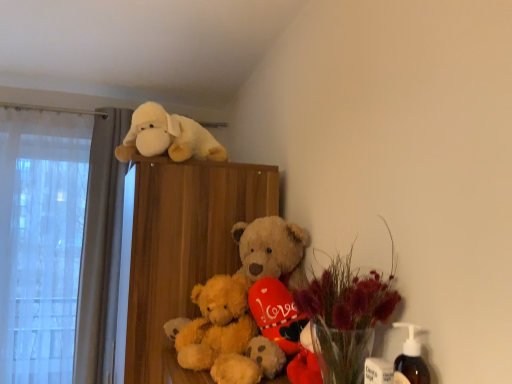
Locate an element on the screen. The height and width of the screenshot is (384, 512). fluffy golden teddy bear at center is located at coordinates (225, 335).

What do you see at coordinates (168, 137) in the screenshot? The height and width of the screenshot is (384, 512). I see `fluffy white plush dog at upper center` at bounding box center [168, 137].

Measure the distance between wooden bookshelf at upper center and camera.

wooden bookshelf at upper center is 1.10 meters away from camera.

Identify the location of translucent glass vase with dried flowers at lower right, which is the first floral arrangement from front to back. (345, 316).

Who is bigger, translucent glass vase with dried flowers at lower right, the 2th floral arrangement in the back-to-front sequence, or fluffy white plush dog at upper center?

fluffy white plush dog at upper center is bigger.

From a real-world perspective, is translucent glass vase with dried flowers at lower right, which is the first floral arrangement from front to back, above or below fluffy white plush dog at upper center?

From a real-world perspective, translucent glass vase with dried flowers at lower right, which is the first floral arrangement from front to back, is physically below fluffy white plush dog at upper center.

From the image's perspective, would you say translucent glass vase with dried flowers at lower right, the 2th floral arrangement in the back-to-front sequence, is positioned over fluffy white plush dog at upper center?

No, from the image's perspective, translucent glass vase with dried flowers at lower right, the 2th floral arrangement in the back-to-front sequence, is not on top of fluffy white plush dog at upper center.

In the scene shown: Considering the sizes of translucent glass vase with dried flowers at lower right, which is the first floral arrangement from front to back, and fluffy white plush dog at upper center in the image, is translucent glass vase with dried flowers at lower right, which is the first floral arrangement from front to back, taller or shorter than fluffy white plush dog at upper center?

translucent glass vase with dried flowers at lower right, which is the first floral arrangement from front to back, is taller than fluffy white plush dog at upper center.

Considering the sizes of objects translucent glass vase with dried flowers at lower right, the 2th floral arrangement in the back-to-front sequence, and translucent glass vase at center, the 2th floral arrangement in the front-to-back sequence, in the image provided, who is shorter, translucent glass vase with dried flowers at lower right, the 2th floral arrangement in the back-to-front sequence, or translucent glass vase at center, the 2th floral arrangement in the front-to-back sequence,?

Standing shorter between the two is translucent glass vase with dried flowers at lower right, the 2th floral arrangement in the back-to-front sequence.

Image resolution: width=512 pixels, height=384 pixels. I want to click on floral arrangement that appears above the translucent glass vase with dried flowers at lower right, which is the first floral arrangement from front to back (from a real-world perspective), so click(x=239, y=290).

Considering the sizes of objects translucent glass vase with dried flowers at lower right, the 2th floral arrangement in the back-to-front sequence, and translucent glass vase at center, the 2th floral arrangement in the front-to-back sequence, in the image provided, who is bigger, translucent glass vase with dried flowers at lower right, the 2th floral arrangement in the back-to-front sequence, or translucent glass vase at center, the 2th floral arrangement in the front-to-back sequence,?

Bigger between the two is translucent glass vase at center, the 2th floral arrangement in the front-to-back sequence.

Is point (378, 301) more distant than point (234, 288)?

No, (378, 301) is closer to viewer.

From a real-world perspective, is fluffy golden teddy bear at center positioned over wooden bookshelf at upper center based on gravity?

Indeed, from a real-world perspective, fluffy golden teddy bear at center stands above wooden bookshelf at upper center.

From the image's perspective, is fluffy golden teddy bear at center below wooden bookshelf at upper center?

No, from the image's perspective, fluffy golden teddy bear at center is not beneath wooden bookshelf at upper center.

Is point (210, 359) behind point (245, 179)?

That is False.

Can you confirm if fluffy golden teddy bear at center is smaller than wooden bookshelf at upper center?

Correct, fluffy golden teddy bear at center occupies less space than wooden bookshelf at upper center.

Does translucent glass vase at center, the 2th floral arrangement in the front-to-back sequence, have a lesser height compared to wooden bookshelf at upper center?

Correct, translucent glass vase at center, the 2th floral arrangement in the front-to-back sequence, is not as tall as wooden bookshelf at upper center.

From the image's perspective, is translucent glass vase at center, the 2th floral arrangement in the front-to-back sequence, located above wooden bookshelf at upper center?

Indeed, from the image's perspective, translucent glass vase at center, the 2th floral arrangement in the front-to-back sequence, is shown above wooden bookshelf at upper center.

Is translucent glass vase at center, which appears as the first floral arrangement when viewed from the back, not within wooden bookshelf at upper center?

translucent glass vase at center, which appears as the first floral arrangement when viewed from the back, is positioned outside wooden bookshelf at upper center.

How far apart are fluffy white plush dog at upper center and wooden bookshelf at upper center?

fluffy white plush dog at upper center and wooden bookshelf at upper center are 24.59 centimeters apart.

Do you think fluffy white plush dog at upper center is within wooden bookshelf at upper center, or outside of it?

fluffy white plush dog at upper center is spatially situated outside wooden bookshelf at upper center.

Would you consider fluffy white plush dog at upper center to be distant from wooden bookshelf at upper center?

No, fluffy white plush dog at upper center is not far from wooden bookshelf at upper center.

Between point (206, 144) and point (142, 251), which one is positioned behind?

Point (206, 144)

Is wooden bookshelf at upper center facing towards translucent glass vase at center, which appears as the first floral arrangement when viewed from the back?

No, wooden bookshelf at upper center is not turned towards translucent glass vase at center, which appears as the first floral arrangement when viewed from the back.

Is wooden bookshelf at upper center touching translucent glass vase at center, the 2th floral arrangement in the front-to-back sequence?

Answer: No.

Based on the photo, from the image's perspective, which one is positioned higher, wooden bookshelf at upper center or translucent glass vase at center, which appears as the first floral arrangement when viewed from the back?

translucent glass vase at center, which appears as the first floral arrangement when viewed from the back.

Considering the positions of objects wooden bookshelf at upper center and translucent glass vase at center, the 2th floral arrangement in the front-to-back sequence, in the image provided, who is behind, wooden bookshelf at upper center or translucent glass vase at center, the 2th floral arrangement in the front-to-back sequence,?

wooden bookshelf at upper center.

From a real-world perspective, which object rests below the other?

fluffy golden teddy bear at center, from a real-world perspective.

Which is closer, [300,241] or [260,374]?

The point [260,374] is in front.

Considering the relative sizes of translucent glass vase at center, which appears as the first floral arrangement when viewed from the back, and fluffy golden teddy bear at center in the image provided, is translucent glass vase at center, which appears as the first floral arrangement when viewed from the back, wider than fluffy golden teddy bear at center?

Yes, translucent glass vase at center, which appears as the first floral arrangement when viewed from the back, is wider than fluffy golden teddy bear at center.

From a real-world perspective, count 2nd floral arrangements upward from the fluffy golden teddy bear at center and point to it. Please provide its 2D coordinates.

[(239, 290)]

Find the location of a particular element. toy that appears above the translucent glass vase with dried flowers at lower right, which is the first floral arrangement from front to back (from the image's perspective) is located at coordinates (168, 137).

I want to click on floral arrangement below the translucent glass vase at center, the 2th floral arrangement in the front-to-back sequence (from the image's perspective), so click(x=345, y=316).

From the picture: Considering their positions, is fluffy white plush dog at upper center positioned further to translucent glass vase at center, the 2th floral arrangement in the front-to-back sequence, than translucent glass vase with dried flowers at lower right, which is the first floral arrangement from front to back?

The object further to translucent glass vase at center, the 2th floral arrangement in the front-to-back sequence, is fluffy white plush dog at upper center.

Based on their spatial positions, is translucent glass vase with dried flowers at lower right, the 2th floral arrangement in the back-to-front sequence, or fluffy white plush dog at upper center further from wooden bookshelf at upper center?

translucent glass vase with dried flowers at lower right, the 2th floral arrangement in the back-to-front sequence.

Considering their positions, is translucent glass vase at center, which appears as the first floral arrangement when viewed from the back, positioned further to fluffy white plush dog at upper center than fluffy golden teddy bear at center?

fluffy golden teddy bear at center is positioned further to the anchor fluffy white plush dog at upper center.

Looking at the image, which one is located closer to fluffy golden teddy bear at center, fluffy white plush dog at upper center or translucent glass vase at center, which appears as the first floral arrangement when viewed from the back?

translucent glass vase at center, which appears as the first floral arrangement when viewed from the back.

From the image, which object appears to be nearer to fluffy golden teddy bear at center, wooden bookshelf at upper center or fluffy white plush dog at upper center?

wooden bookshelf at upper center.

When comparing their distances from translucent glass vase with dried flowers at lower right, which is the first floral arrangement from front to back, does fluffy white plush dog at upper center or translucent glass vase at center, the 2th floral arrangement in the front-to-back sequence, seem further?

Among the two, fluffy white plush dog at upper center is located further to translucent glass vase with dried flowers at lower right, which is the first floral arrangement from front to back.

When comparing their distances from wooden bookshelf at upper center, does fluffy white plush dog at upper center or translucent glass vase with dried flowers at lower right, the 2th floral arrangement in the back-to-front sequence, seem further?

translucent glass vase with dried flowers at lower right, the 2th floral arrangement in the back-to-front sequence, is further to wooden bookshelf at upper center.

From the image, which object appears to be farther from translucent glass vase at center, which appears as the first floral arrangement when viewed from the back, wooden bookshelf at upper center or translucent glass vase with dried flowers at lower right, which is the first floral arrangement from front to back?

translucent glass vase with dried flowers at lower right, which is the first floral arrangement from front to back, is further to translucent glass vase at center, which appears as the first floral arrangement when viewed from the back.

I want to click on floral arrangement situated between wooden bookshelf at upper center and translucent glass vase with dried flowers at lower right, which is the first floral arrangement from front to back, from left to right, so click(x=239, y=290).

Where is `floral arrangement located between translucent glass vase with dried flowers at lower right, the 2th floral arrangement in the back-to-front sequence, and fluffy golden teddy bear at center in the depth direction`? This screenshot has width=512, height=384. floral arrangement located between translucent glass vase with dried flowers at lower right, the 2th floral arrangement in the back-to-front sequence, and fluffy golden teddy bear at center in the depth direction is located at coordinates [239, 290].

Where is `floral arrangement between fluffy white plush dog at upper center and translucent glass vase with dried flowers at lower right, which is the first floral arrangement from front to back, from top to bottom`? This screenshot has height=384, width=512. floral arrangement between fluffy white plush dog at upper center and translucent glass vase with dried flowers at lower right, which is the first floral arrangement from front to back, from top to bottom is located at coordinates (239, 290).

Locate an element on the screen. This screenshot has width=512, height=384. teddy bear between fluffy white plush dog at upper center and wooden bookshelf at upper center in the vertical direction is located at coordinates (225, 335).